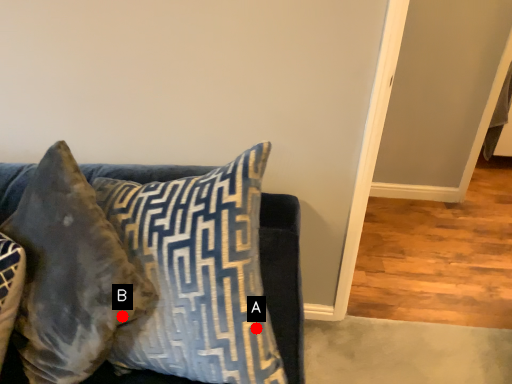
Question: Two points are circled on the image, labeled by A and B beside each circle. Among these points, which one is nearest to the camera?

Choices:
 (A) A is closer
 (B) B is closer

Answer: (A)